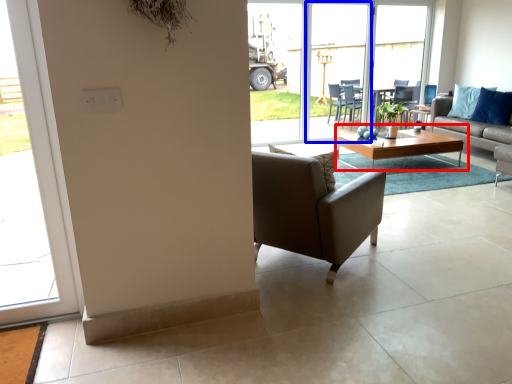
Question: Which point is further to the camera, coffee table (highlighted by a red box) or screen door (highlighted by a blue box)?

Choices:
 (A) coffee table
 (B) screen door

Answer: (B)